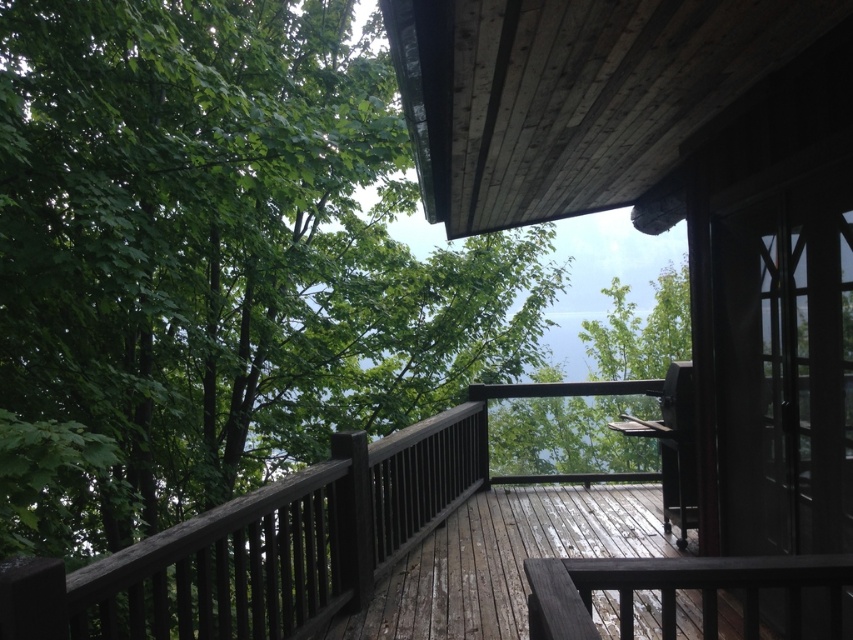
Which is behind, point (587, 385) or point (552, 589)?

Point (587, 385)

Does weathered wood porch at center appear on the right side of dark brown wood balustrade at lower right?

In fact, weathered wood porch at center is to the left of dark brown wood balustrade at lower right.

Locate an element on the screen. The image size is (853, 640). weathered wood porch at center is located at coordinates (283, 538).

Identify the location of weathered wood porch at center. (283, 538).

Does dark brown wood balustrade at lower right have a smaller size compared to green leafy tree at center?

Indeed, dark brown wood balustrade at lower right has a smaller size compared to green leafy tree at center.

Does point (838, 589) come behind point (639, 355)?

That is False.

Is point (576, 612) closer to camera compared to point (630, 461)?

Yes, point (576, 612) is closer to viewer.

The width and height of the screenshot is (853, 640). Find the location of `dark brown wood balustrade at lower right`. dark brown wood balustrade at lower right is located at coordinates (674, 589).

Looking at this image, is green leafy tree at upper left positioned at the back of green leafy tree at center?

No, green leafy tree at upper left is in front of green leafy tree at center.

What do you see at coordinates (215, 260) in the screenshot? This screenshot has width=853, height=640. I see `green leafy tree at upper left` at bounding box center [215, 260].

The width and height of the screenshot is (853, 640). Identify the location of green leafy tree at upper left. (215, 260).